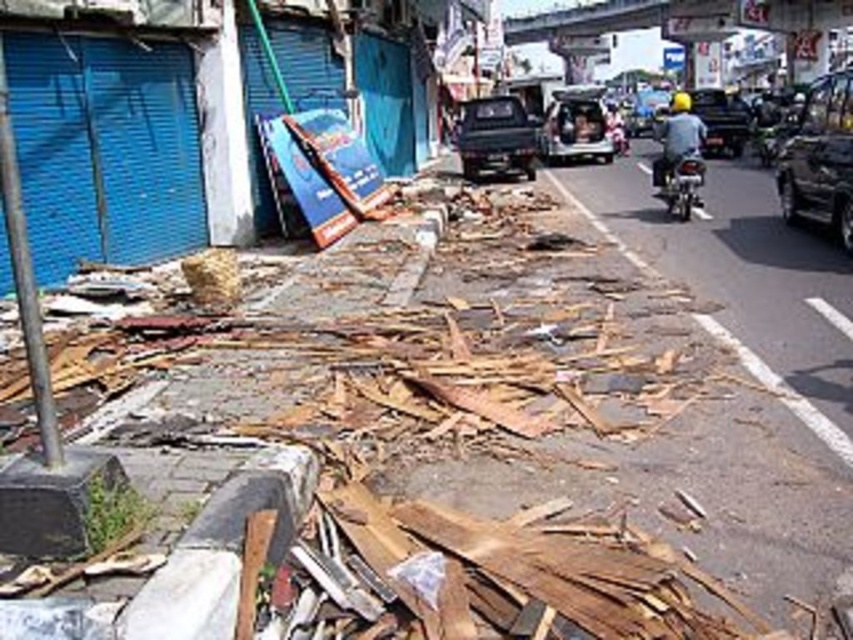
The height and width of the screenshot is (640, 853). I want to click on shiny black car at right, so click(820, 160).

Does shiny black car at right have a greater width compared to green matte van at center?

Indeed, shiny black car at right has a greater width compared to green matte van at center.

Locate an element on the screen. This screenshot has height=640, width=853. shiny black car at right is located at coordinates (x=820, y=160).

I want to click on shiny black car at right, so click(x=820, y=160).

Can you confirm if green matte van at center is positioned to the left of denim jacket at center?

Yes, green matte van at center is to the left of denim jacket at center.

Describe the element at coordinates (576, 125) in the screenshot. Image resolution: width=853 pixels, height=640 pixels. I see `green matte van at center` at that location.

Which is in front, point (550, 145) or point (672, 129)?

Positioned in front is point (672, 129).

Image resolution: width=853 pixels, height=640 pixels. Identify the location of green matte van at center. (576, 125).

Which is below, denim jacket at center or metallic silver motorcycle at right?

Positioned lower is metallic silver motorcycle at right.

Is denim jacket at center to the left of metallic silver motorcycle at right from the viewer's perspective?

No, denim jacket at center is not to the left of metallic silver motorcycle at right.

The height and width of the screenshot is (640, 853). What are the coordinates of `denim jacket at center` in the screenshot? It's located at (676, 138).